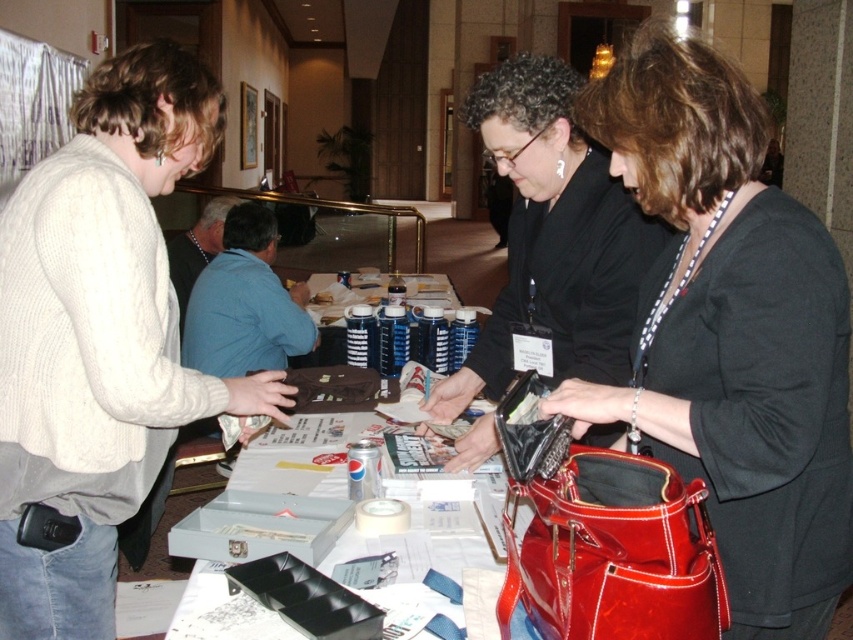
Who is more forward, (51, 228) or (612, 436)?

Point (51, 228)

At what (x,y) coordinates should I click in order to perform the action: click on white knit sweater at left. Please return your answer as a coordinate pair (x, y). The image size is (853, 640). Looking at the image, I should click on (97, 339).

This screenshot has width=853, height=640. I want to click on white knit sweater at left, so click(97, 339).

Looking at this image, can you confirm if black leather purse at center is bigger than glossy patent leather handbag at lower right?

Yes, black leather purse at center is bigger than glossy patent leather handbag at lower right.

Is black leather purse at center behind glossy patent leather handbag at lower right?

Yes, it is.

Is point (608, 289) less distant than point (579, 566)?

No, (608, 289) is behind (579, 566).

I want to click on black leather purse at center, so click(553, 237).

Is shiny patent leather handbag at center below white knit sweater at left?

No.

Who is shorter, shiny patent leather handbag at center or white knit sweater at left?

shiny patent leather handbag at center

Is point (689, 346) positioned behind point (74, 476)?

No, (689, 346) is in front of (74, 476).

The image size is (853, 640). I want to click on shiny patent leather handbag at center, so click(x=730, y=332).